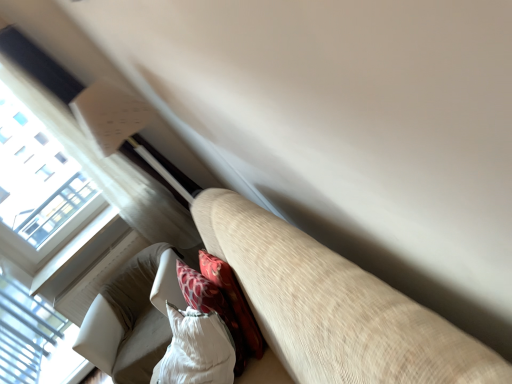
Question: Visually, is beige fabric couch at lower left positioned to the left or to the right of white plastic window at lower left?

Choices:
 (A) right
 (B) left

Answer: (A)

Question: From the image's perspective, relative to white plastic window at lower left, is beige fabric couch at lower left above or below?

Choices:
 (A) below
 (B) above

Answer: (B)

Question: Which object is the farthest from the beige fabric couch at lower left?

Choices:
 (A) white plastic window at lower left
 (B) white textured bean bag chair at lower left, which ranks as the first bean bag chair in back-to-front order
 (C) white textured bean bag chair at lower center, acting as the 2th bean bag chair starting from the back

Answer: (A)

Question: Based on their relative distances, which object is farther from the white plastic window at lower left?

Choices:
 (A) beige fabric couch at lower left
 (B) white textured bean bag chair at lower left, which ranks as the first bean bag chair in back-to-front order
 (C) white textured bean bag chair at lower center, acting as the 2th bean bag chair starting from the back

Answer: (A)